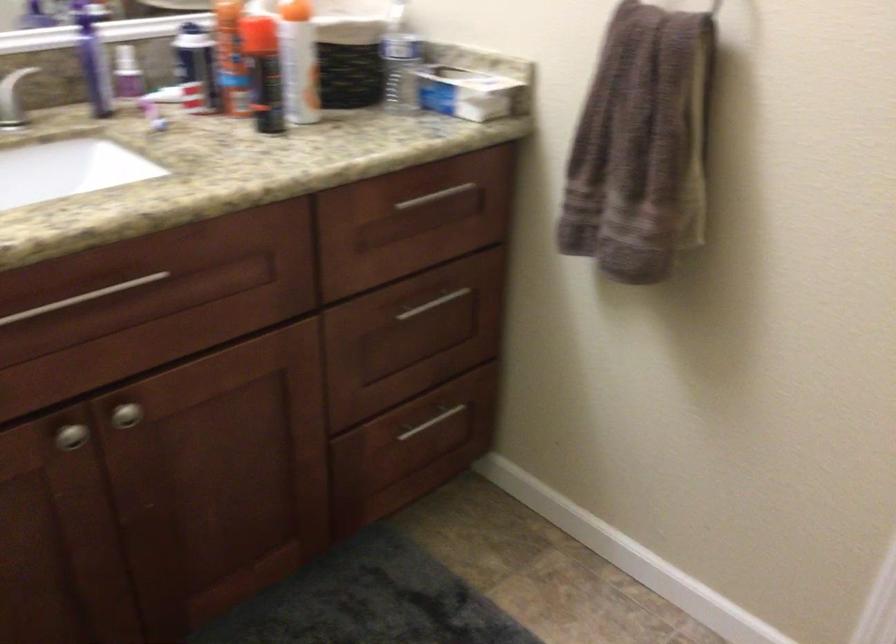
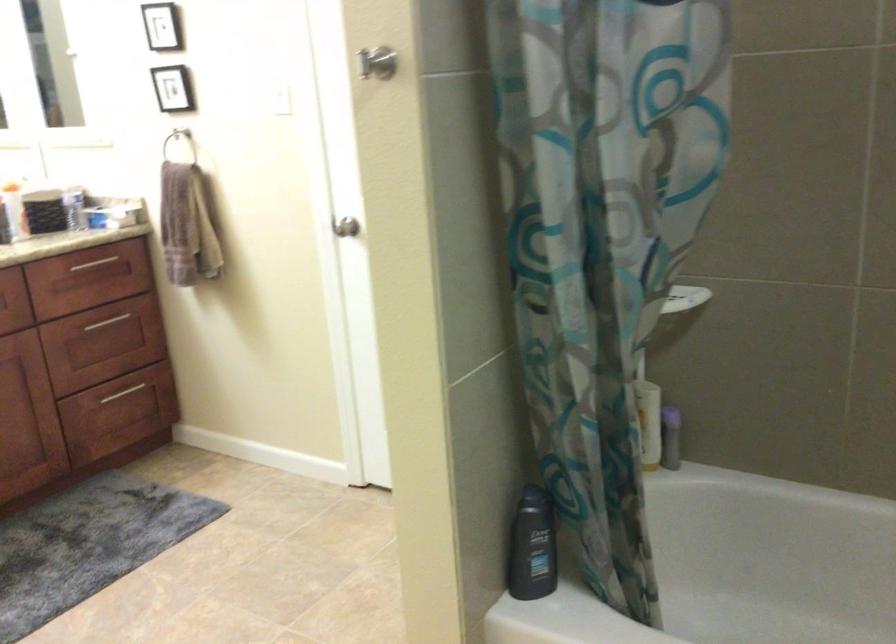
Find the pixel in the second image that matches the point at 423,433 in the first image.

(122, 393)